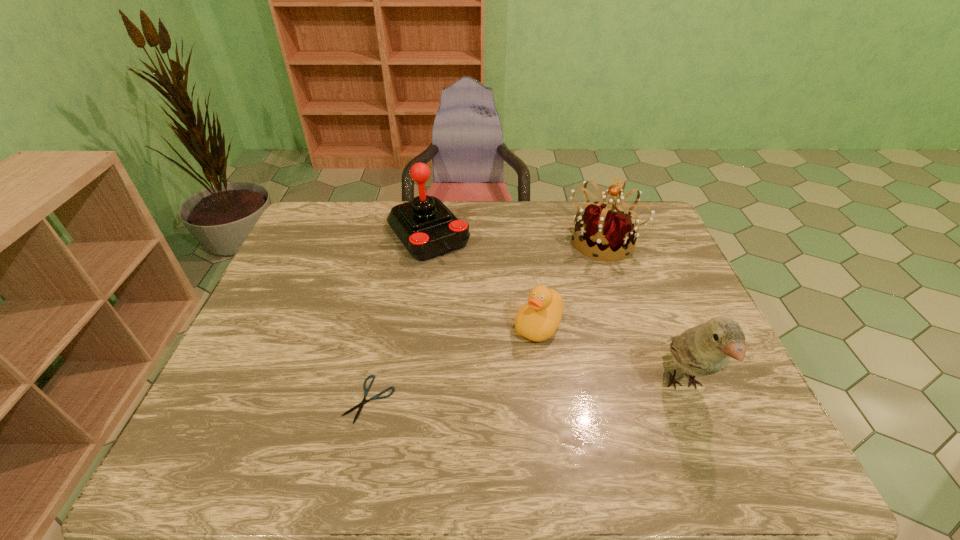
Locate an element on the screen. This screenshot has width=960, height=540. bird that is at the right edge is located at coordinates (705, 349).

This screenshot has width=960, height=540. Find the location of `tiara located in the right edge section of the desktop`. tiara located in the right edge section of the desktop is located at coordinates (605, 227).

Locate an element on the screen. The width and height of the screenshot is (960, 540). object that is at the far right corner is located at coordinates (605, 227).

Locate an element on the screen. The width and height of the screenshot is (960, 540). object present at the near right corner is located at coordinates (705, 349).

I want to click on vacant space at the far edge of the desktop, so click(533, 239).

Where is `blank area at the near edge`? The height and width of the screenshot is (540, 960). blank area at the near edge is located at coordinates (525, 403).

Locate an element on the screen. This screenshot has height=540, width=960. vacant space at the left edge is located at coordinates (244, 381).

I want to click on vacant region at the far right corner, so click(654, 239).

Where is `free space between the third object from left to right and the bird`? The height and width of the screenshot is (540, 960). free space between the third object from left to right and the bird is located at coordinates (612, 354).

Where is `empty space that is in between the fourth tallest object and the bird`? empty space that is in between the fourth tallest object and the bird is located at coordinates (612, 354).